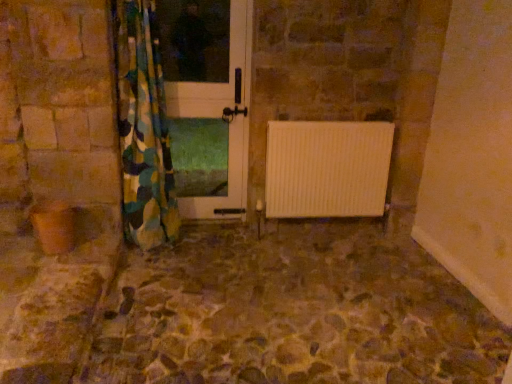
Question: Does camouflage fabric curtain at left have a lesser height compared to stone textured floor at center?

Choices:
 (A) no
 (B) yes

Answer: (A)

Question: Does camouflage fabric curtain at left have a lesser width compared to stone textured floor at center?

Choices:
 (A) no
 (B) yes

Answer: (B)

Question: Is camouflage fabric curtain at left taller than stone textured floor at center?

Choices:
 (A) yes
 (B) no

Answer: (A)

Question: Can you confirm if camouflage fabric curtain at left is bigger than stone textured floor at center?

Choices:
 (A) yes
 (B) no

Answer: (A)

Question: From a real-world perspective, is camouflage fabric curtain at left on top of stone textured floor at center?

Choices:
 (A) yes
 (B) no

Answer: (A)

Question: Considering the relative sizes of camouflage fabric curtain at left and stone textured floor at center in the image provided, is camouflage fabric curtain at left wider than stone textured floor at center?

Choices:
 (A) no
 (B) yes

Answer: (A)

Question: Considering the relative sizes of white glossy door at center and stone textured floor at center in the image provided, is white glossy door at center taller than stone textured floor at center?

Choices:
 (A) yes
 (B) no

Answer: (A)

Question: Is white glossy door at center facing away from stone textured floor at center?

Choices:
 (A) yes
 (B) no

Answer: (B)

Question: Is stone textured floor at center completely or partially inside white glossy door at center?

Choices:
 (A) yes
 (B) no

Answer: (B)

Question: Could you tell me if white glossy door at center is facing stone textured floor at center?

Choices:
 (A) no
 (B) yes

Answer: (B)

Question: Can you confirm if white glossy door at center is smaller than stone textured floor at center?

Choices:
 (A) yes
 (B) no

Answer: (A)

Question: From a real-world perspective, is white glossy door at center physically above stone textured floor at center?

Choices:
 (A) yes
 (B) no

Answer: (A)

Question: Is stone textured floor at center far away from camouflage fabric curtain at left?

Choices:
 (A) no
 (B) yes

Answer: (B)